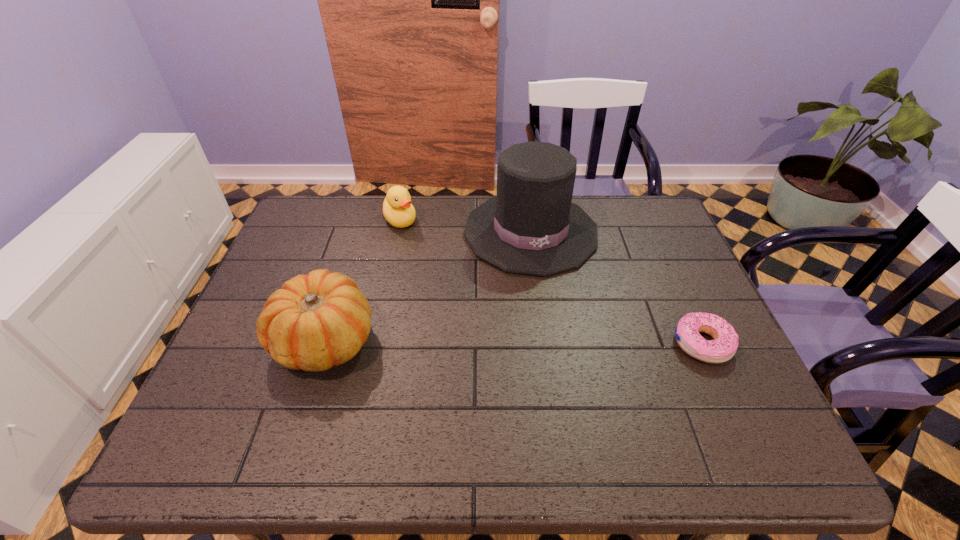
Locate an element on the screen. This screenshot has height=540, width=960. free region at the far edge is located at coordinates (349, 236).

Find the location of a particular element. The height and width of the screenshot is (540, 960). free space at the near edge of the desktop is located at coordinates (601, 384).

Image resolution: width=960 pixels, height=540 pixels. In the image, there is a desktop. Find the location of `vacant region at the left edge`. vacant region at the left edge is located at coordinates (249, 341).

In the image, there is a desktop. At what (x,y) coordinates should I click in order to perform the action: click on blank space at the right edge. Please return your answer as a coordinate pair (x, y). Looking at the image, I should click on 679,284.

At what (x,y) coordinates should I click in order to perform the action: click on vacant space at the far right corner of the desktop. Please return your answer as a coordinate pair (x, y). This screenshot has width=960, height=540. Looking at the image, I should click on (633, 197).

In order to click on vacant region between the second shortest object and the doughnut in this screenshot , I will do `click(551, 281)`.

At what (x,y) coordinates should I click in order to perform the action: click on blank region between the doughnut and the duckling. Please return your answer as a coordinate pair (x, y). Looking at the image, I should click on coord(551,281).

What are the coordinates of `vacant space in between the second object from right to left and the duckling` in the screenshot? It's located at (466, 226).

Locate an element on the screen. This screenshot has height=540, width=960. vacant area between the tallest object and the shortest object is located at coordinates (616, 288).

Find the location of a particular element. The width and height of the screenshot is (960, 540). vacant space that's between the second shortest object and the shortest object is located at coordinates (551, 281).